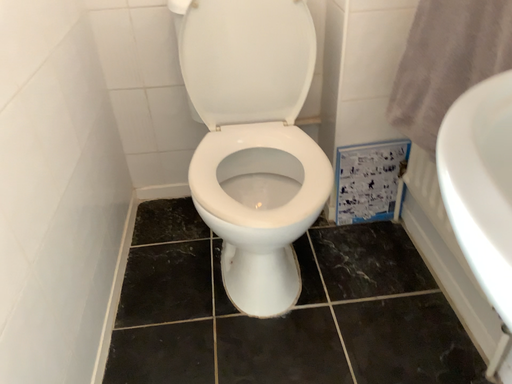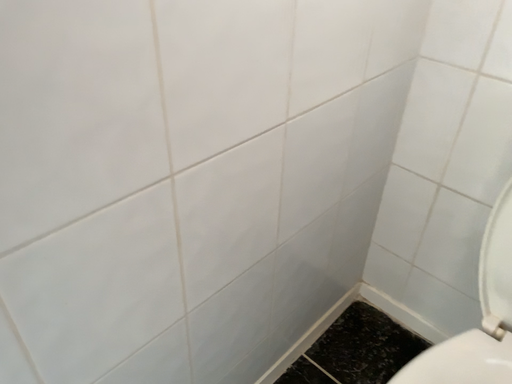
Question: Which way did the camera rotate in the video?

Choices:
 (A) rotated downward
 (B) rotated upward

Answer: (B)